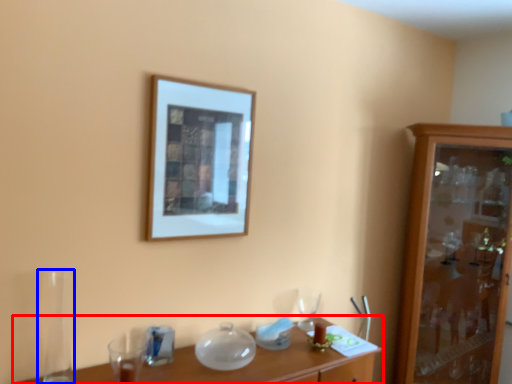
Question: Which point is further to the camera, table (highlighted by a red box) or glass vase (highlighted by a blue box)?

Choices:
 (A) table
 (B) glass vase

Answer: (B)